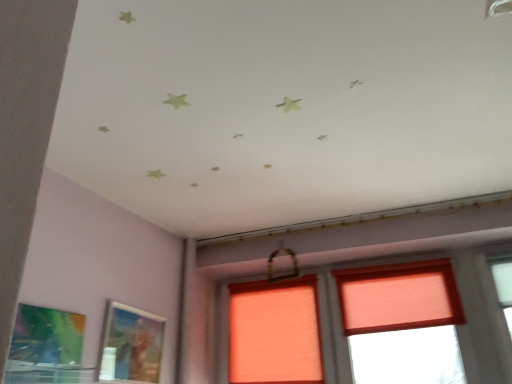
Question: Could matte green painting at lower left, which is the 2th picture frame from right to left, be considered to be inside metallic silver picture frame at lower left, which ranks as the 2th picture frame in front-to-back order?

Choices:
 (A) no
 (B) yes

Answer: (A)

Question: From the image's perspective, is metallic silver picture frame at lower left, positioned as the 2th picture frame in left-to-right order, on top of matte green painting at lower left, the first picture frame in the front-to-back sequence?

Choices:
 (A) yes
 (B) no

Answer: (B)

Question: From a real-world perspective, is metallic silver picture frame at lower left, which ranks as the 2th picture frame in front-to-back order, physically above matte green painting at lower left, the first picture frame positioned from the left?

Choices:
 (A) no
 (B) yes

Answer: (B)

Question: Can you confirm if metallic silver picture frame at lower left, marked as the first picture frame in a right-to-left arrangement, is bigger than matte green painting at lower left, which is the 2th picture frame from right to left?

Choices:
 (A) yes
 (B) no

Answer: (A)

Question: Considering the relative sizes of metallic silver picture frame at lower left, positioned as the 2th picture frame in left-to-right order, and matte green painting at lower left, the first picture frame in the front-to-back sequence, in the image provided, is metallic silver picture frame at lower left, positioned as the 2th picture frame in left-to-right order, shorter than matte green painting at lower left, the first picture frame in the front-to-back sequence,?

Choices:
 (A) yes
 (B) no

Answer: (A)

Question: Is the depth of metallic silver picture frame at lower left, marked as the first picture frame in a back-to-front arrangement, greater than that of matte green painting at lower left, which ranks as the 2th picture frame in back-to-front order?

Choices:
 (A) no
 (B) yes

Answer: (B)

Question: Does orange fabric window at center have a greater height compared to matte green painting at lower left, the first picture frame in the front-to-back sequence?

Choices:
 (A) no
 (B) yes

Answer: (B)

Question: Are orange fabric window at center and matte green painting at lower left, the first picture frame in the front-to-back sequence, making contact?

Choices:
 (A) no
 (B) yes

Answer: (A)

Question: Is orange fabric window at center positioned in front of matte green painting at lower left, which ranks as the 2th picture frame in back-to-front order?

Choices:
 (A) yes
 (B) no

Answer: (B)

Question: Is orange fabric window at center bigger than matte green painting at lower left, which is the 2th picture frame from right to left?

Choices:
 (A) no
 (B) yes

Answer: (B)

Question: Would you say matte green painting at lower left, which is the 2th picture frame from right to left, is part of orange fabric window at center's contents?

Choices:
 (A) no
 (B) yes

Answer: (A)

Question: From a real-world perspective, is orange fabric window at center positioned over matte green painting at lower left, the first picture frame positioned from the left, based on gravity?

Choices:
 (A) no
 (B) yes

Answer: (B)

Question: Is matte green painting at lower left, the first picture frame in the front-to-back sequence, in contact with metallic silver picture frame at lower left, positioned as the 2th picture frame in left-to-right order?

Choices:
 (A) no
 (B) yes

Answer: (A)